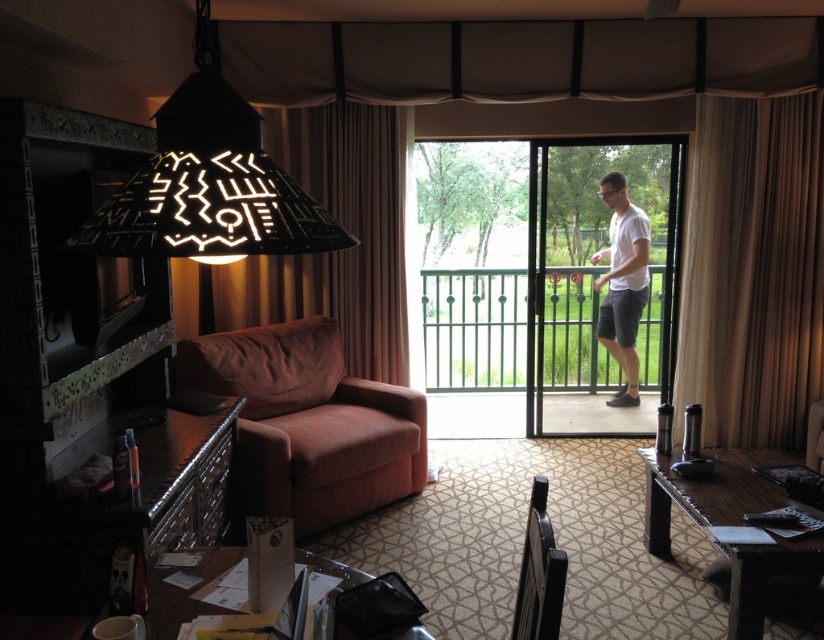
You are standing in the living room and want to reach the balcony. There is a point at coordinates (373, 348) that is 4.48 meters away from you. Can you estimate how far you need to walk to reach the balcony?

The point at coordinates (373, 348) is 4.48 meters away from the viewer. Since the balcony is accessible through the sliding glass doors, you would need to walk approximately 4.48 meters to reach it.